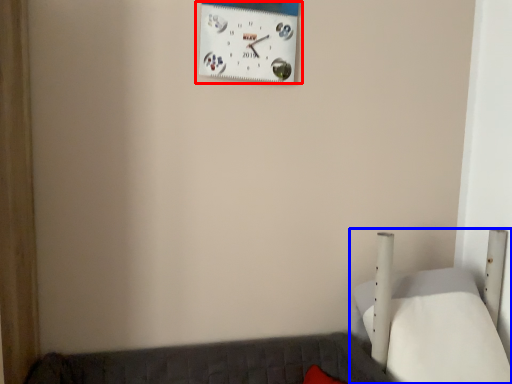
Question: Among these objects, which one is nearest to the camera, wall clock (highlighted by a red box) or furniture (highlighted by a blue box)?

Choices:
 (A) wall clock
 (B) furniture

Answer: (B)